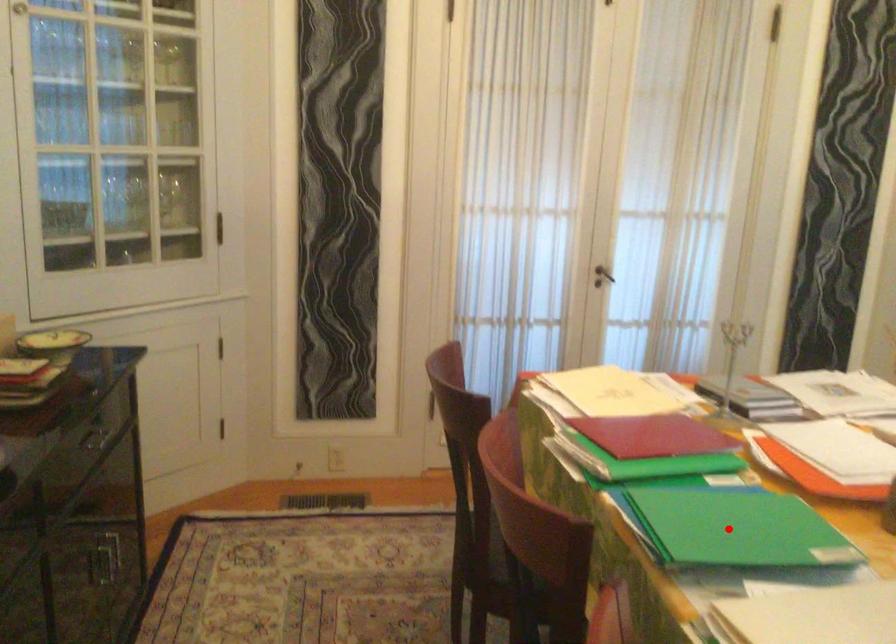
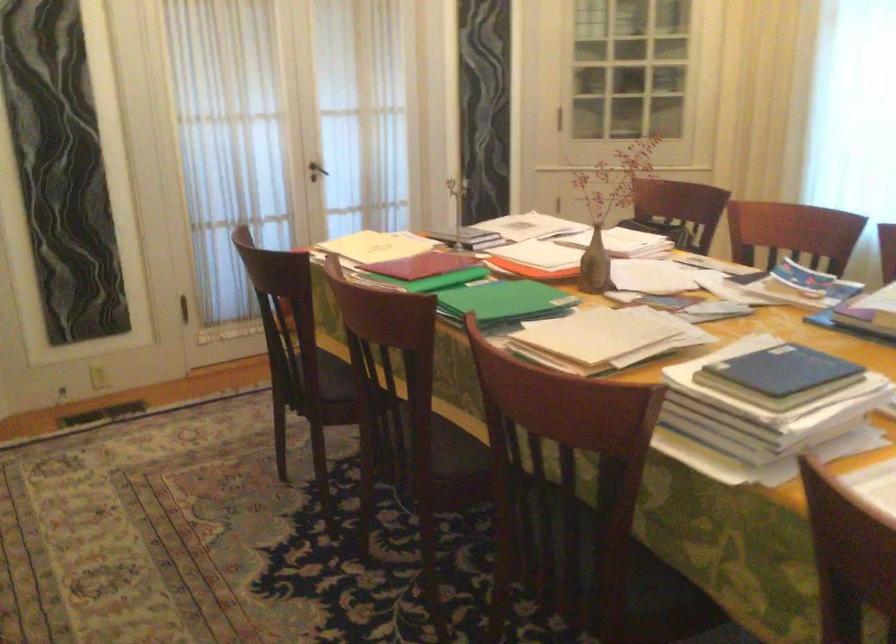
Find the pixel in the second image that matches the highlighted location in the first image.

(504, 301)